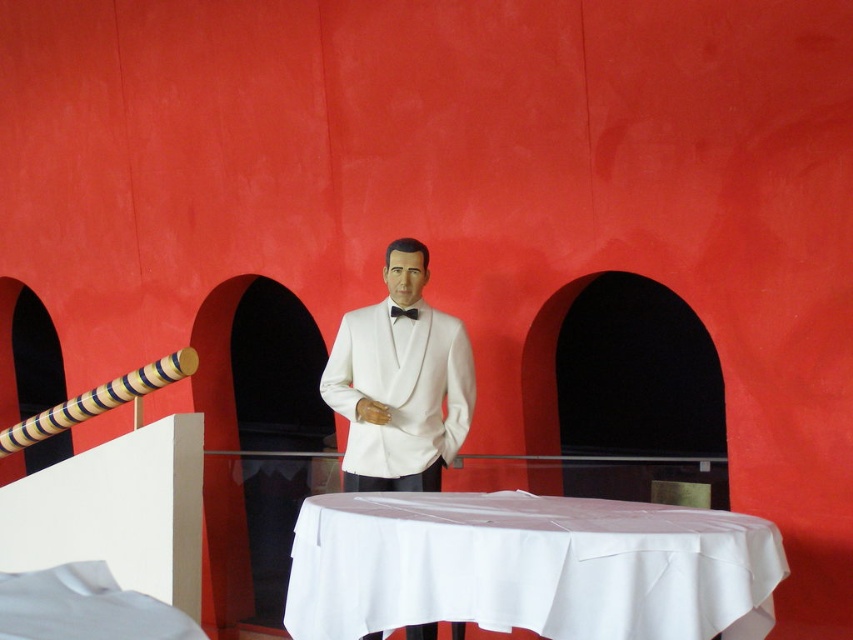
Is white cloth-covered table at center to the left of white glossy tuxedo at center from the viewer's perspective?

No, white cloth-covered table at center is not to the left of white glossy tuxedo at center.

Does white cloth-covered table at center have a greater height compared to white glossy tuxedo at center?

No, white cloth-covered table at center is not taller than white glossy tuxedo at center.

The height and width of the screenshot is (640, 853). I want to click on white cloth-covered table at center, so click(x=529, y=566).

Does point (440, 371) lie behind point (395, 310)?

That is False.

Does white glossy tuxedo at center come behind black satin bow tie at center?

No.

Does point (352, 440) come farther from viewer compared to point (401, 310)?

That is False.

Identify the location of white glossy tuxedo at center. (399, 381).

From the picture: Who is positioned more to the left, white cloth-covered table at center or black satin bow tie at center?

Positioned to the left is black satin bow tie at center.

Is white cloth-covered table at center thinner than black satin bow tie at center?

Incorrect, white cloth-covered table at center's width is not less than black satin bow tie at center's.

Image resolution: width=853 pixels, height=640 pixels. Describe the element at coordinates (529, 566) in the screenshot. I see `white cloth-covered table at center` at that location.

Where is `white cloth-covered table at center`? Image resolution: width=853 pixels, height=640 pixels. white cloth-covered table at center is located at coordinates pos(529,566).